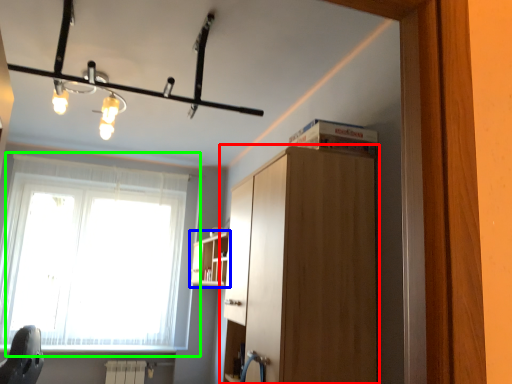
Question: Based on their relative distances, which object is nearer to cabinetry (highlighted by a red box)? Choose from shelf (highlighted by a blue box) and window (highlighted by a green box).

Choices:
 (A) shelf
 (B) window

Answer: (A)